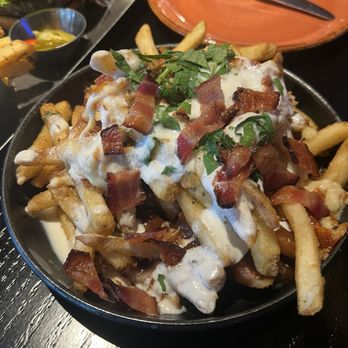
Identify the location of tray. (108, 15).